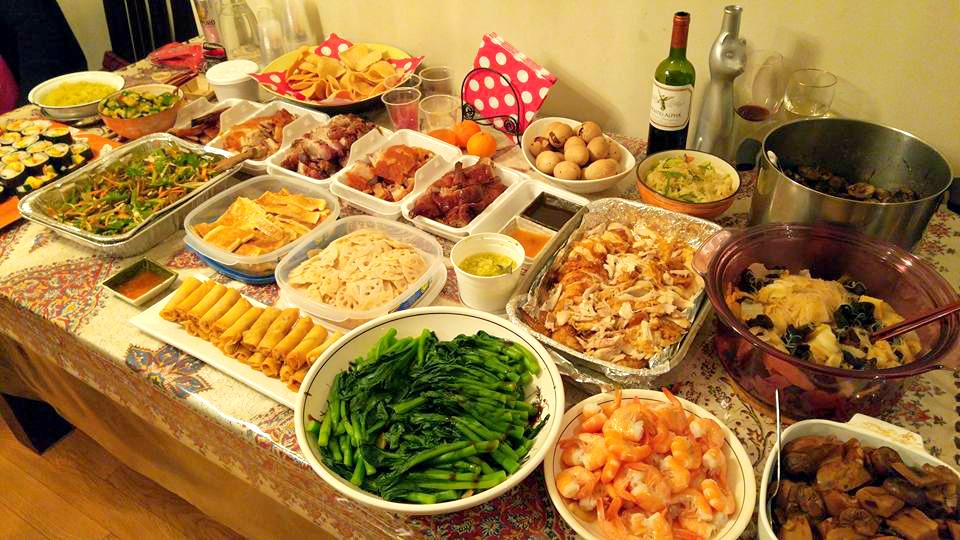
Locate an element on the screen. cup is located at coordinates (445, 127), (403, 102), (417, 83), (435, 86).